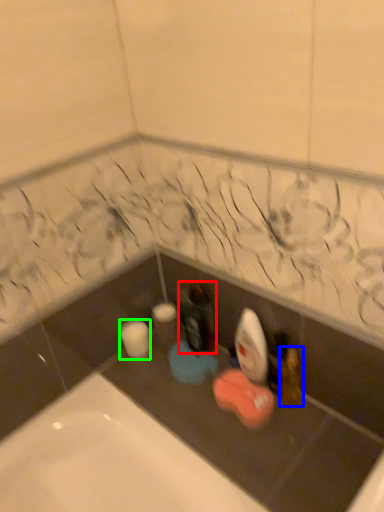
Question: Which is nearer to the bottle (highlighted by a red box)? toiletry (highlighted by a blue box) or toilet paper (highlighted by a green box).

Choices:
 (A) toiletry
 (B) toilet paper

Answer: (B)